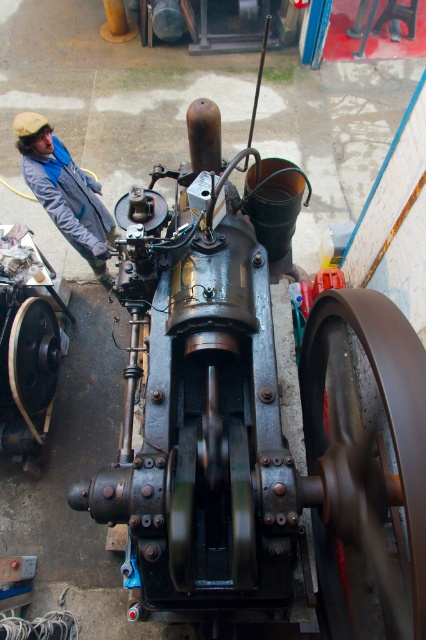
You are a technician in the workshop and need to locate the gray fabric jacket at left and the matte black wheel at left. Based on the scene description, which object is closer to the center of the workshop?

The gray fabric jacket at left is positioned on the right side of matte black wheel at left. Since the matte black wheel at left is to the left of the jacket, the jacket is closer to the center than the wheel.

You are a maintenance worker in the workshop and need to access the matte black wheel at left for inspection. However, the gray fabric jacket at left is blocking your path. Can you move around the jacket to reach the wheel without moving it?

The matte black wheel at left is behind the gray fabric jacket at left, so you can move around the jacket to access the wheel without moving it.

You are an engineer inspecting the workshop. You notice the brown rubber wheel at center right and the matte black wheel at left. Which wheel is positioned lower in the image?

The brown rubber wheel at center right is positioned lower than the matte black wheel at left.